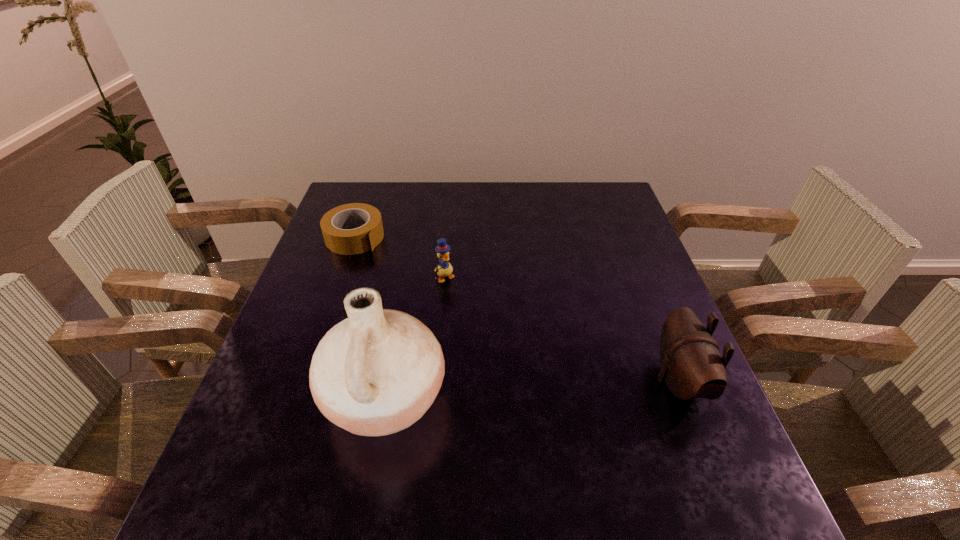
Locate an element on the screen. This screenshot has width=960, height=540. pottery that is at the near edge is located at coordinates (377, 372).

Locate an element on the screen. pouch that is at the near edge is located at coordinates (691, 365).

You are a GUI agent. You are given a task and a screenshot of the screen. Output one action in this format:
    pyautogui.click(x=<x>, y=<y>)
    Task: Click on the pottery present at the left edge
    
    Given the screenshot: What is the action you would take?
    pyautogui.click(x=377, y=372)

Where is `duct tape present at the left edge`? Image resolution: width=960 pixels, height=540 pixels. duct tape present at the left edge is located at coordinates point(335,224).

The image size is (960, 540). In order to click on object that is at the right edge in this screenshot , I will do `click(691, 365)`.

Identify the location of object at the far left corner. (335, 224).

This screenshot has width=960, height=540. Find the location of `object that is at the near left corner`. object that is at the near left corner is located at coordinates (377, 372).

This screenshot has height=540, width=960. What are the coordinates of `object at the near right corner` in the screenshot? It's located at (691, 365).

This screenshot has height=540, width=960. Identify the location of blank space at the far edge of the desktop. (479, 198).

In the image, there is a desktop. Where is `free space at the near edge`? The image size is (960, 540). free space at the near edge is located at coordinates (447, 457).